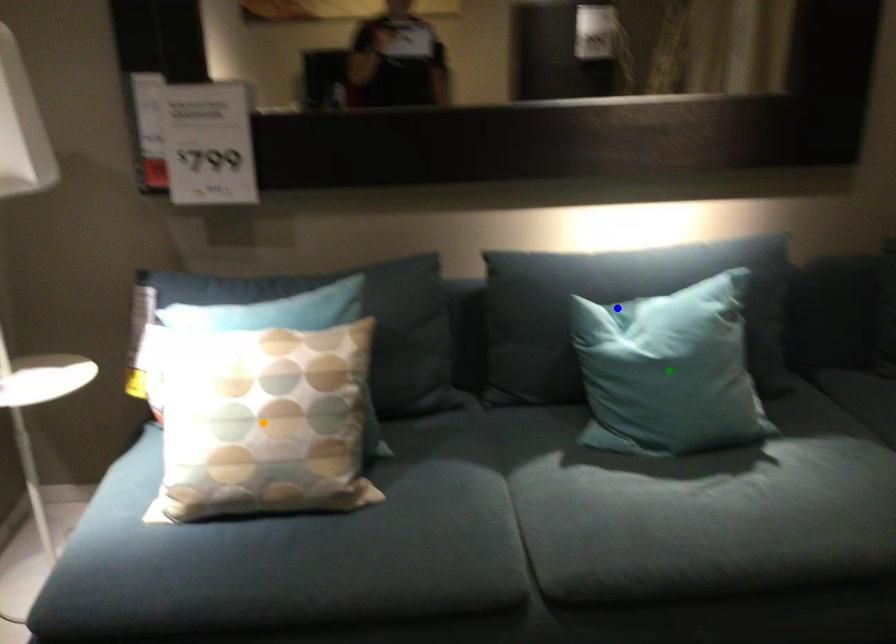
Order these from nearest to farthest:
green point
orange point
blue point

orange point < green point < blue point